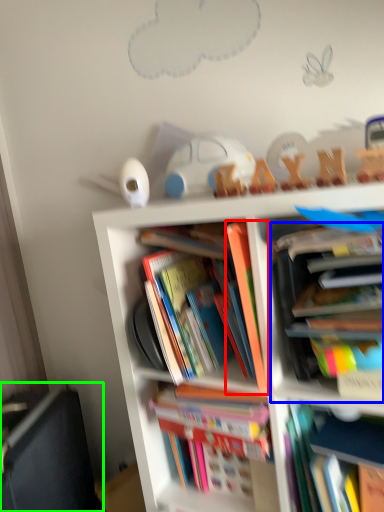
Question: Which object is positioned farthest from book (highlighted by a red box)? Select from book (highlighted by a blue box) and shelf (highlighted by a green box).

Choices:
 (A) book
 (B) shelf

Answer: (B)